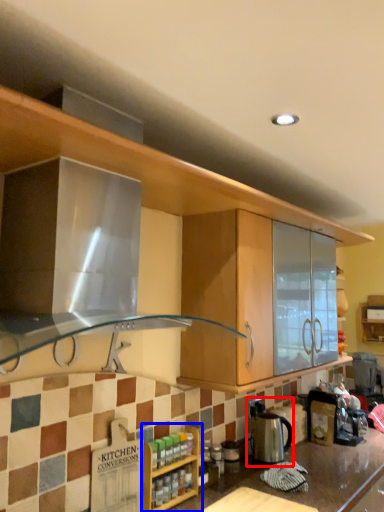
Question: Among these objects, which one is nearest to the camera, appliance (highlighted by a red box) or cabinetry (highlighted by a blue box)?

Choices:
 (A) appliance
 (B) cabinetry

Answer: (B)